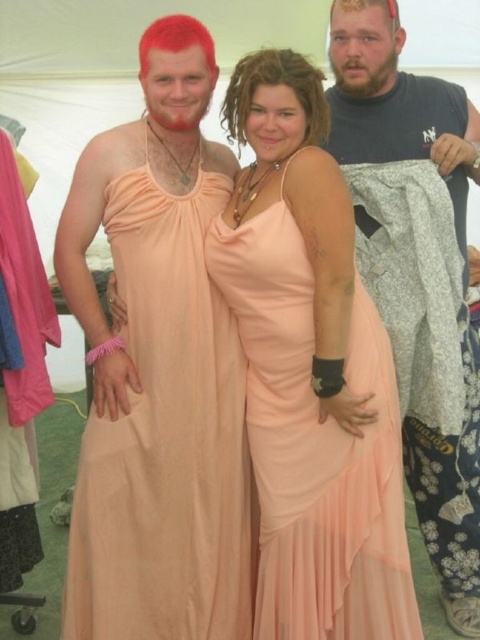
Looking at this image, is peach satin dress at center positioned in front of gray fabric shirt at right?

Yes, peach satin dress at center is in front of gray fabric shirt at right.

What do you see at coordinates (165, 435) in the screenshot?
I see `peach satin dress at center` at bounding box center [165, 435].

Is point (188, 237) positioned after point (455, 179)?

No.

Find the location of a particular element. This screenshot has width=480, height=640. peach satin dress at center is located at coordinates (165, 435).

Can you confirm if peach chiffon dress at center is positioned above gray fabric shirt at right?

No.

Based on the photo, which is more to the left, peach chiffon dress at center or gray fabric shirt at right?

Positioned to the left is peach chiffon dress at center.

Does point (388, 364) lie behind point (332, 38)?

No, it is not.

Locate an element on the screen. The image size is (480, 640). peach chiffon dress at center is located at coordinates (314, 444).

Does point (119, 264) lie in front of point (395, 513)?

No, (119, 264) is behind (395, 513).

Is peach satin dress at center positioned behind peach chiffon dress at center?

Yes, it is behind peach chiffon dress at center.

At what (x,y) coordinates should I click in order to perform the action: click on peach satin dress at center. Please return your answer as a coordinate pair (x, y). The width and height of the screenshot is (480, 640). Looking at the image, I should click on (165, 435).